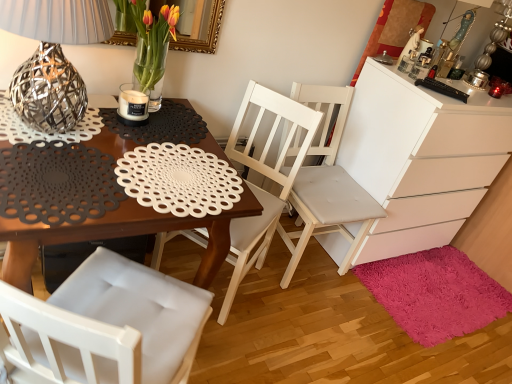
Question: Does shaggy pink rug at lower right touch white matte chest of drawers at right?

Choices:
 (A) yes
 (B) no

Answer: (B)

Question: From a real-world perspective, is shaggy pink rug at lower right located beneath white matte chest of drawers at right?

Choices:
 (A) yes
 (B) no

Answer: (A)

Question: Is shaggy pink rug at lower right at the left side of white matte chest of drawers at right?

Choices:
 (A) no
 (B) yes

Answer: (A)

Question: Is shaggy pink rug at lower right turned away from white matte chest of drawers at right?

Choices:
 (A) yes
 (B) no

Answer: (A)

Question: Considering the relative sizes of shaggy pink rug at lower right and white matte chest of drawers at right in the image provided, is shaggy pink rug at lower right smaller than white matte chest of drawers at right?

Choices:
 (A) no
 (B) yes

Answer: (B)

Question: Is there a large distance between shaggy pink rug at lower right and white matte chest of drawers at right?

Choices:
 (A) no
 (B) yes

Answer: (A)

Question: Can you confirm if white wood chair at center, which is counted as the 2th chair, starting from the right, is shorter than matte glass vase with tulips at upper center?

Choices:
 (A) no
 (B) yes

Answer: (A)

Question: Is white wood chair at center, the 1th chair viewed from the left, located outside matte glass vase with tulips at upper center?

Choices:
 (A) no
 (B) yes

Answer: (B)

Question: Is the position of white wood chair at center, the 1th chair viewed from the left, more distant than that of matte glass vase with tulips at upper center?

Choices:
 (A) yes
 (B) no

Answer: (A)

Question: From a real-world perspective, is white wood chair at center, the 1th chair viewed from the left, located higher than matte glass vase with tulips at upper center?

Choices:
 (A) no
 (B) yes

Answer: (A)

Question: Is white wood chair at center, which is counted as the 2th chair, starting from the right, aimed at matte glass vase with tulips at upper center?

Choices:
 (A) no
 (B) yes

Answer: (A)

Question: Does white wood chair at center, which is counted as the 2th chair, starting from the right, have a lesser width compared to matte glass vase with tulips at upper center?

Choices:
 (A) yes
 (B) no

Answer: (B)

Question: Can you confirm if white matte chest of drawers at right is taller than matte black placemat at center?

Choices:
 (A) yes
 (B) no

Answer: (A)